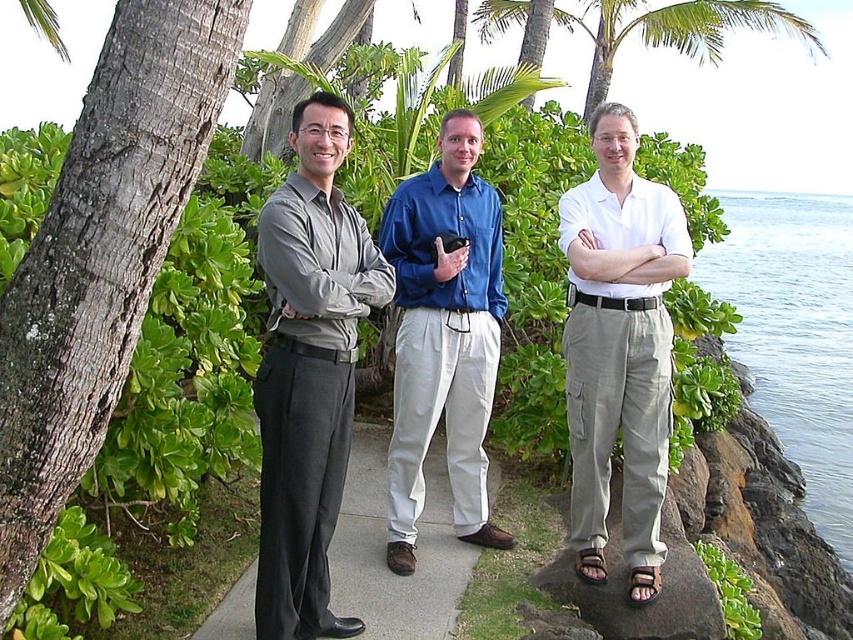
Question: Is blue liquid water at right positioned behind green leafy palm tree at upper center?

Choices:
 (A) no
 (B) yes

Answer: (A)

Question: Is gray bark tree trunk at left closer to the viewer compared to blue liquid water at right?

Choices:
 (A) yes
 (B) no

Answer: (A)

Question: Which point is closer to the camera taking this photo?

Choices:
 (A) (538, 36)
 (B) (666, 221)

Answer: (B)

Question: Which object is positioned closest to the blue cotton shirt at center?

Choices:
 (A) gray bark tree trunk at left
 (B) green leafy palm tree at upper center
 (C) blue liquid water at right
 (D) black smooth pavement at center

Answer: (D)

Question: Which of these objects is positioned farthest from the gray bark tree trunk at left?

Choices:
 (A) green leafy palm tree at upper center
 (B) black smooth pavement at center
 (C) matte gray shirt at center
 (D) blue liquid water at right

Answer: (D)

Question: Does matte gray shirt at center have a greater width compared to blue liquid water at right?

Choices:
 (A) no
 (B) yes

Answer: (A)